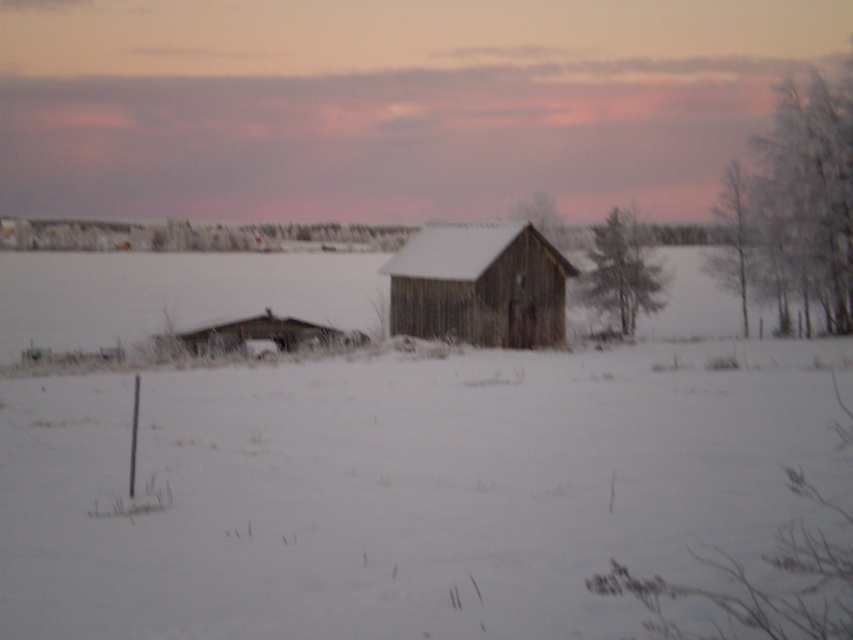
Question: Which point is closer to the camera taking this photo?

Choices:
 (A) (538, 202)
 (B) (741, 225)

Answer: (B)

Question: In this image, where is white frosty tree at upper right located relative to smooth bark tree at right?

Choices:
 (A) right
 (B) left

Answer: (A)

Question: Is weathered wood barn at center to the left of smooth wooden house at center from the viewer's perspective?

Choices:
 (A) yes
 (B) no

Answer: (A)

Question: Which object is farther from the camera taking this photo?

Choices:
 (A) smooth bark tree at right
 (B) white frosty tree at upper right
 (C) green textured pine at center
 (D) smooth wooden house at center

Answer: (C)

Question: Considering the real-world distances, which object is closest to the green textured pine at center?

Choices:
 (A) white frosty tree at upper right
 (B) smooth wooden house at center

Answer: (A)

Question: Is green textured pine at center wider than smooth bark tree at right?

Choices:
 (A) no
 (B) yes

Answer: (A)